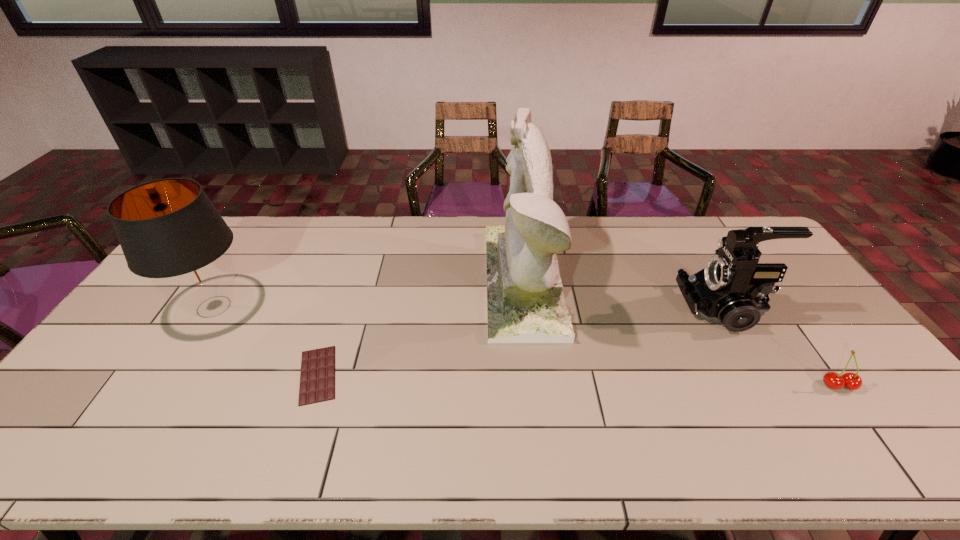
Identify the location of object that stands as the third closest to the cherry. (317, 378).